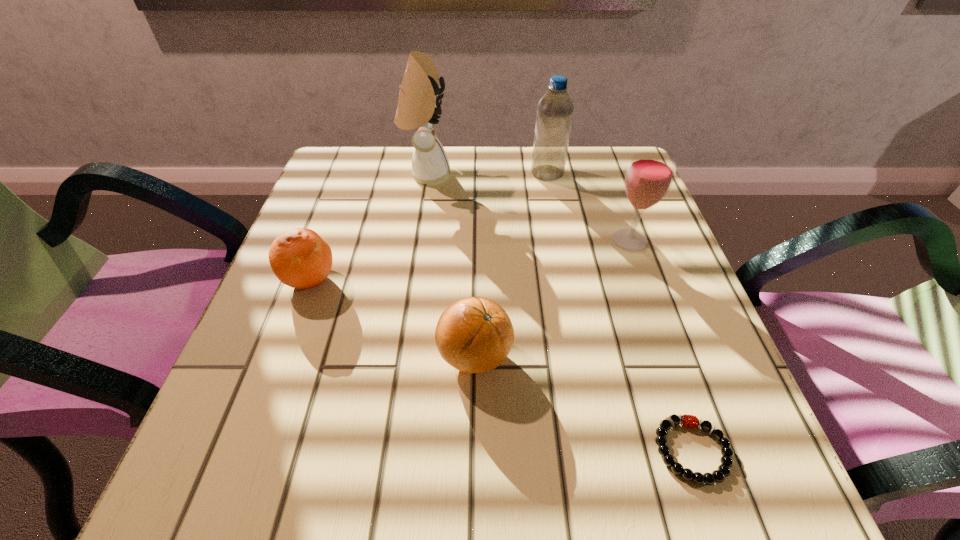
This screenshot has height=540, width=960. Find the location of `object that is at the near edge`. object that is at the near edge is located at coordinates (689, 421).

The height and width of the screenshot is (540, 960). Find the location of `object that is at the left edge`. object that is at the left edge is located at coordinates (300, 258).

Locate an element on the screen. The image size is (960, 540). wineglass positioned at the right edge is located at coordinates (649, 176).

The height and width of the screenshot is (540, 960). What are the coordinates of `bracelet positioned at the right edge` in the screenshot? It's located at (689, 421).

In order to click on object that is positioned at the near right corner in this screenshot , I will do `click(689, 421)`.

This screenshot has height=540, width=960. I want to click on vacant space at the far edge of the desktop, so click(540, 201).

Locate an element on the screen. Image resolution: width=960 pixels, height=540 pixels. blank area at the near edge is located at coordinates (502, 463).

I want to click on free space at the right edge of the desktop, so click(653, 300).

You are a GUI agent. You are given a task and a screenshot of the screen. Output one action in this format:
    pyautogui.click(x=<x>, y=<y>)
    Task: Click on the vacant space at the far left corner of the desktop
    The width and height of the screenshot is (960, 540).
    Given the screenshot: What is the action you would take?
    point(343,163)

This screenshot has width=960, height=540. In the image, there is a desktop. What are the coordinates of `blank space at the near left corner` in the screenshot? It's located at (245, 442).